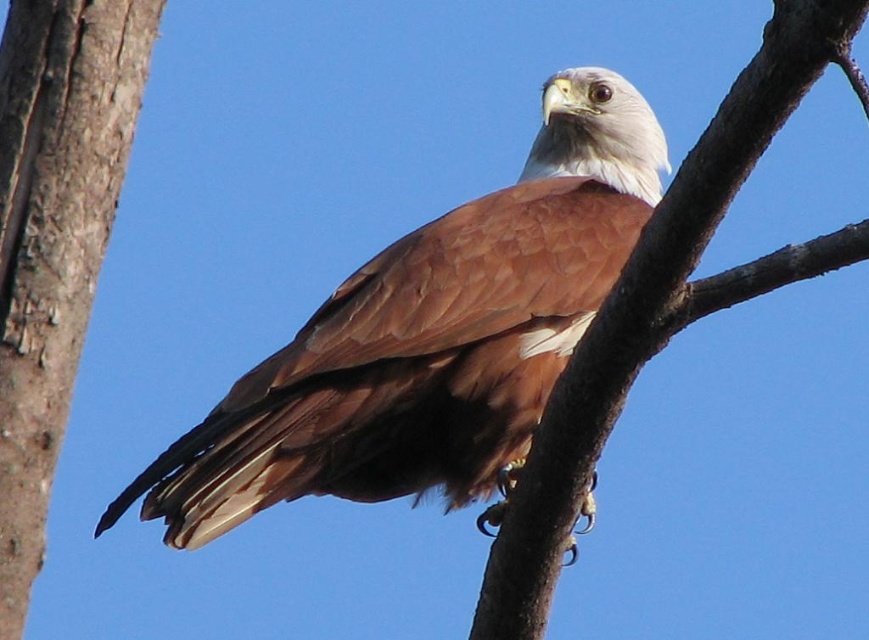
Does brown feathered eagle at center appear under brown textured branch at center?

Actually, brown feathered eagle at center is above brown textured branch at center.

Which is more to the left, brown feathered eagle at center or brown textured branch at center?

brown feathered eagle at center

I want to click on brown feathered eagle at center, so click(x=430, y=337).

Which is below, rough bark tree trunk at left or brown textured branch at center?

brown textured branch at center is below.

Which is above, rough bark tree trunk at left or brown textured branch at center?

rough bark tree trunk at left is higher up.

Measure the distance between point (36, 529) and camera.

Point (36, 529) and camera are 12.64 feet apart from each other.

At what (x,y) coordinates should I click in order to perform the action: click on rough bark tree trunk at left. Please return your answer as a coordinate pair (x, y). The image size is (869, 640). Looking at the image, I should click on pos(54,236).

Is brown feathered eagle at center to the right of rough bark tree trunk at left from the viewer's perspective?

Indeed, brown feathered eagle at center is positioned on the right side of rough bark tree trunk at left.

Can you confirm if brown feathered eagle at center is positioned below rough bark tree trunk at left?

Yes.

Does point (644, 209) lie behind point (97, 45)?

No, it is in front of (97, 45).

At what (x,y) coordinates should I click in order to perform the action: click on brown feathered eagle at center. Please return your answer as a coordinate pair (x, y). The image size is (869, 640). Looking at the image, I should click on point(430,337).